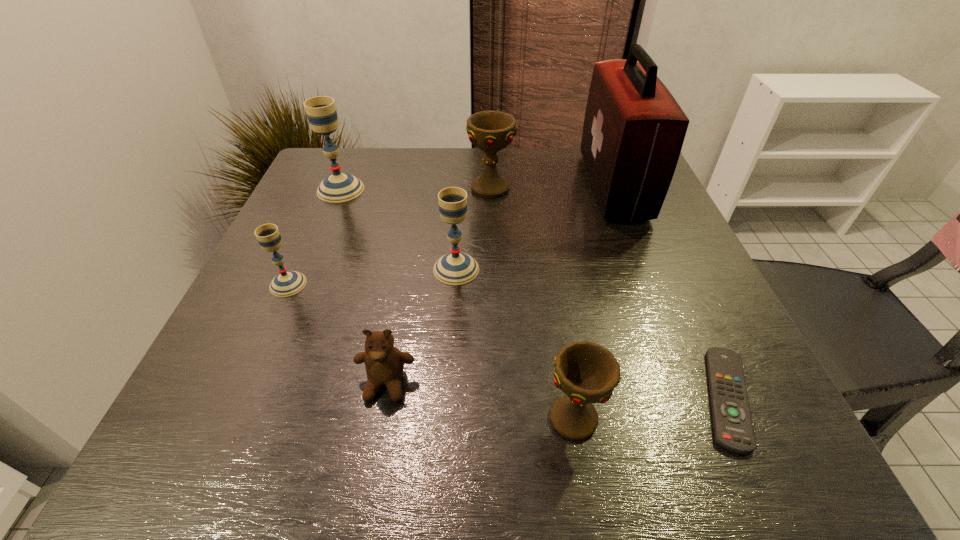
The image size is (960, 540). Identify the location of free point located 0.310m on the back of the sixth object from left to right. (548, 261).

Where is `vacant space located 0.110m on the back of the remote control`? vacant space located 0.110m on the back of the remote control is located at coordinates (684, 304).

What are the coordinates of `the first aid kit positioned at the far edge` in the screenshot? It's located at (634, 129).

Image resolution: width=960 pixels, height=540 pixels. Find the location of `chalice situated at the near edge`. chalice situated at the near edge is located at coordinates (587, 373).

This screenshot has height=540, width=960. Find the location of `remote control at the near edge`. remote control at the near edge is located at coordinates (733, 429).

The image size is (960, 540). I want to click on the first aid kit located in the right edge section of the desktop, so click(634, 129).

Where is `remote control at the right edge`? remote control at the right edge is located at coordinates (733, 429).

Identify the location of object that is at the far left corner. (321, 112).

The height and width of the screenshot is (540, 960). In order to click on object at the far right corner in this screenshot , I will do `click(634, 129)`.

Where is `object that is at the near right corner`? Image resolution: width=960 pixels, height=540 pixels. object that is at the near right corner is located at coordinates (733, 429).